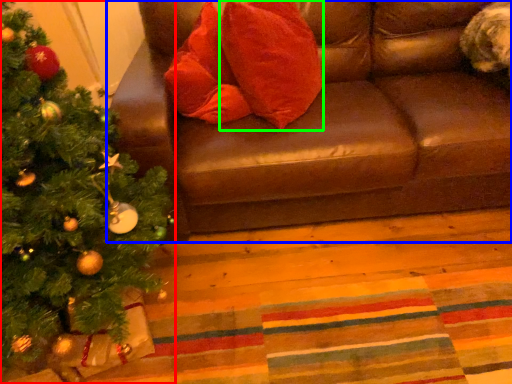
Question: Considering the real-world distances, which object is farthest from christmas tree (highlighted by a red box)? studio couch (highlighted by a blue box) or throw pillow (highlighted by a green box)?

Choices:
 (A) studio couch
 (B) throw pillow

Answer: (B)